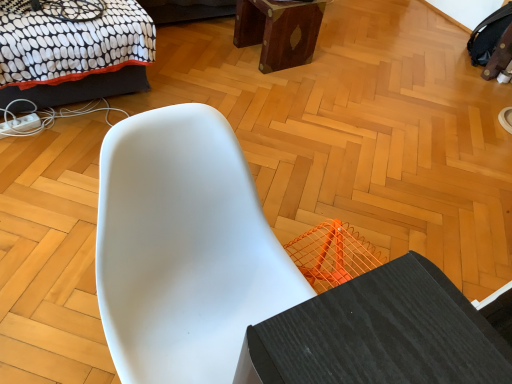
Question: From the image's perspective, would you say white matte chair at center is positioned over black dotted fabric bed at upper left?

Choices:
 (A) yes
 (B) no

Answer: (B)

Question: Is black dotted fabric bed at upper left at the back of white matte chair at center?

Choices:
 (A) yes
 (B) no

Answer: (A)

Question: Is white matte chair at center next to black dotted fabric bed at upper left and touching it?

Choices:
 (A) yes
 (B) no

Answer: (B)

Question: Is black dotted fabric bed at upper left located within white matte chair at center?

Choices:
 (A) no
 (B) yes

Answer: (A)

Question: Is white matte chair at center smaller than black dotted fabric bed at upper left?

Choices:
 (A) yes
 (B) no

Answer: (B)

Question: Can you confirm if white matte chair at center is wider than black dotted fabric bed at upper left?

Choices:
 (A) yes
 (B) no

Answer: (B)

Question: Is mahogany wood stool at upper center positioned in front of black dotted fabric bed at upper left?

Choices:
 (A) no
 (B) yes

Answer: (A)

Question: Does mahogany wood stool at upper center appear on the right side of black dotted fabric bed at upper left?

Choices:
 (A) yes
 (B) no

Answer: (A)

Question: Can black dotted fabric bed at upper left be found inside mahogany wood stool at upper center?

Choices:
 (A) no
 (B) yes

Answer: (A)

Question: Is mahogany wood stool at upper center aimed at black dotted fabric bed at upper left?

Choices:
 (A) yes
 (B) no

Answer: (B)

Question: Can you confirm if mahogany wood stool at upper center is positioned to the left of black dotted fabric bed at upper left?

Choices:
 (A) no
 (B) yes

Answer: (A)

Question: From a real-world perspective, is mahogany wood stool at upper center on black dotted fabric bed at upper left?

Choices:
 (A) no
 (B) yes

Answer: (A)

Question: Considering the relative sizes of black dotted fabric bed at upper left and white matte chair at center in the image provided, is black dotted fabric bed at upper left taller than white matte chair at center?

Choices:
 (A) yes
 (B) no

Answer: (B)